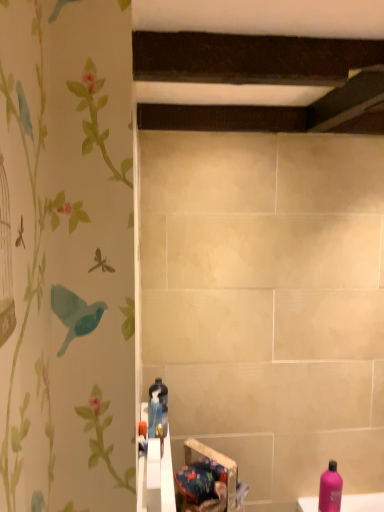
Where is `pink glossy bottle at lower right`? The image size is (384, 512). pink glossy bottle at lower right is located at coordinates (330, 489).

What do you see at coordinates (330, 489) in the screenshot? I see `pink glossy bottle at lower right` at bounding box center [330, 489].

Where is `pink glossy bottle at lower right`? This screenshot has height=512, width=384. pink glossy bottle at lower right is located at coordinates (330, 489).